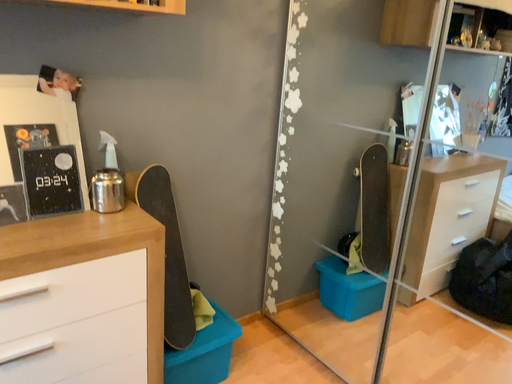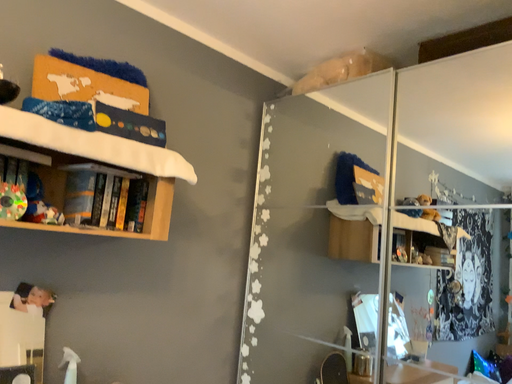
Question: How did the camera likely rotate when shooting the video?

Choices:
 (A) rotated right
 (B) rotated left

Answer: (A)